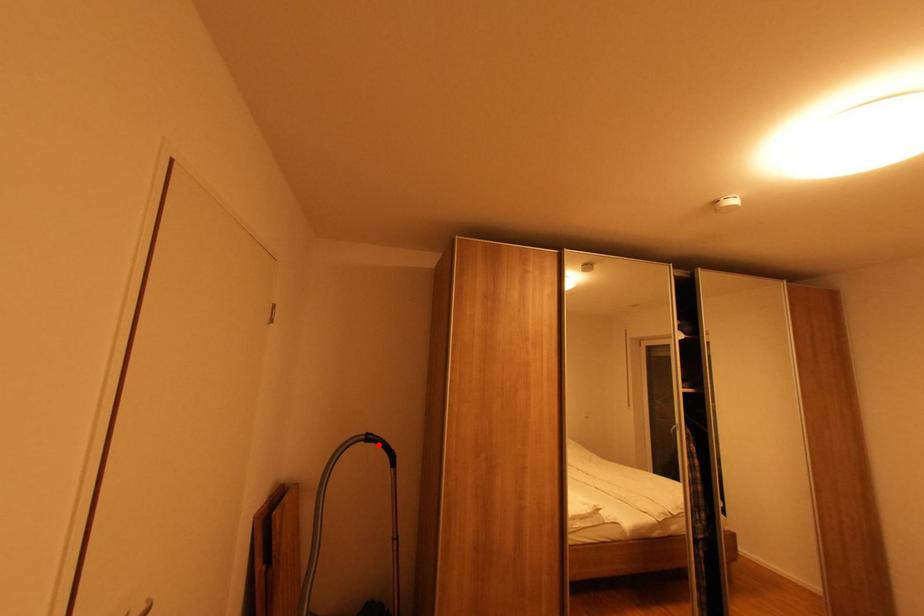
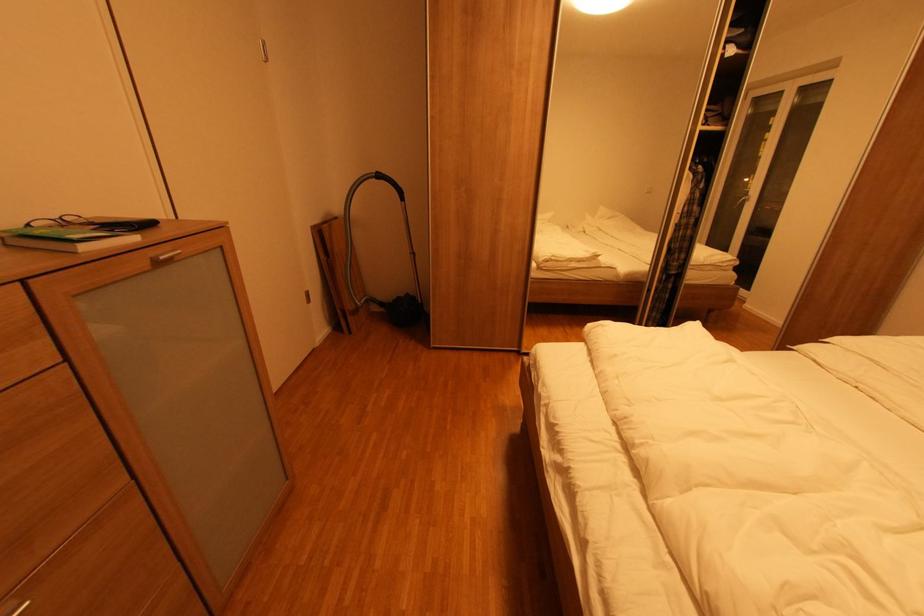
Question: I am providing you with two images of the same scene from different viewpoints. In image1, a red point is highlighted. Considering the same 3D point in image2, which of the following is correct?

Choices:
 (A) It is closer
 (B) It is farther

Answer: (A)